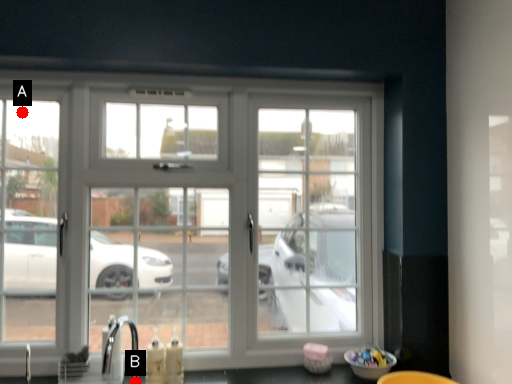
Question: Two points are circled on the image, labeled by A and B beside each circle. Which point is closer to the camera taking this photo?

Choices:
 (A) A is closer
 (B) B is closer

Answer: (B)